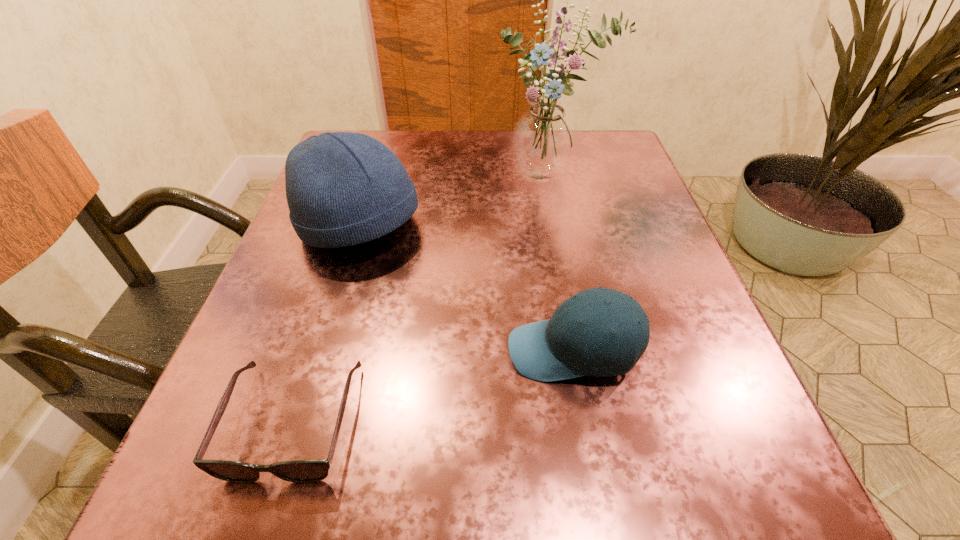
Where is `object positioned at the near edge`? The width and height of the screenshot is (960, 540). object positioned at the near edge is located at coordinates (300, 471).

You are a GUI agent. You are given a task and a screenshot of the screen. Output one action in this format:
    pyautogui.click(x=<x>, y=<y>)
    Task: Click on the skullcap at the left edge
    The image size is (960, 540).
    Given the screenshot: What is the action you would take?
    pyautogui.click(x=342, y=188)

Image resolution: width=960 pixels, height=540 pixels. I want to click on sunglasses present at the left edge, so click(x=300, y=471).

At what (x,y) coordinates should I click in order to perform the action: click on bouquet located at the right edge. Please return your answer as a coordinate pair (x, y). Looking at the image, I should click on (544, 139).

I want to click on baseball cap that is at the right edge, so click(560, 348).

This screenshot has width=960, height=540. In order to click on object situated at the near left corner in this screenshot , I will do `click(300, 471)`.

In order to click on object that is at the far right corner in this screenshot , I will do `click(544, 139)`.

In the image, there is a desktop. In order to click on free space at the near edge in this screenshot , I will do `click(373, 469)`.

Identify the location of blank space at the left edge. (300, 426).

In the image, there is a desktop. Identify the location of vacant space at the right edge. The height and width of the screenshot is (540, 960). (625, 292).